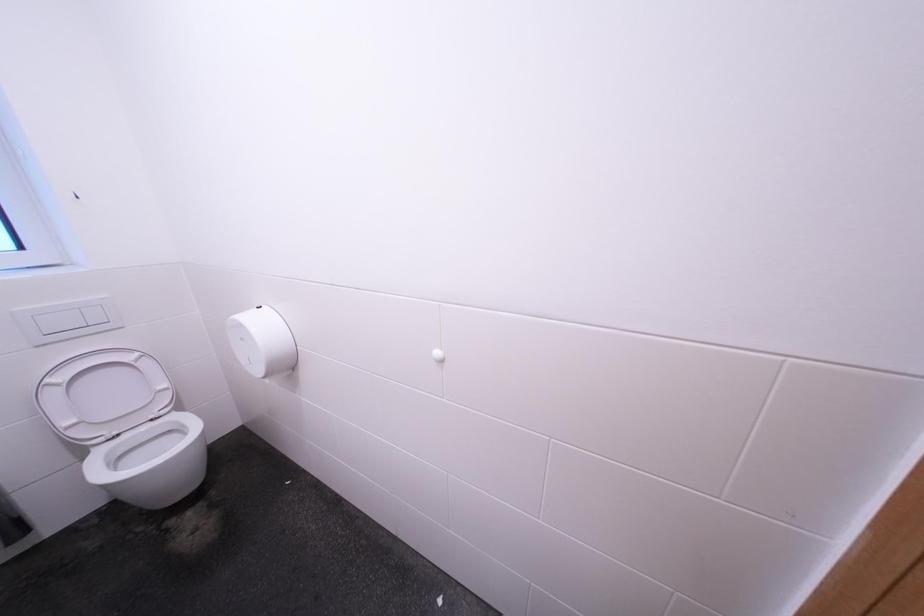
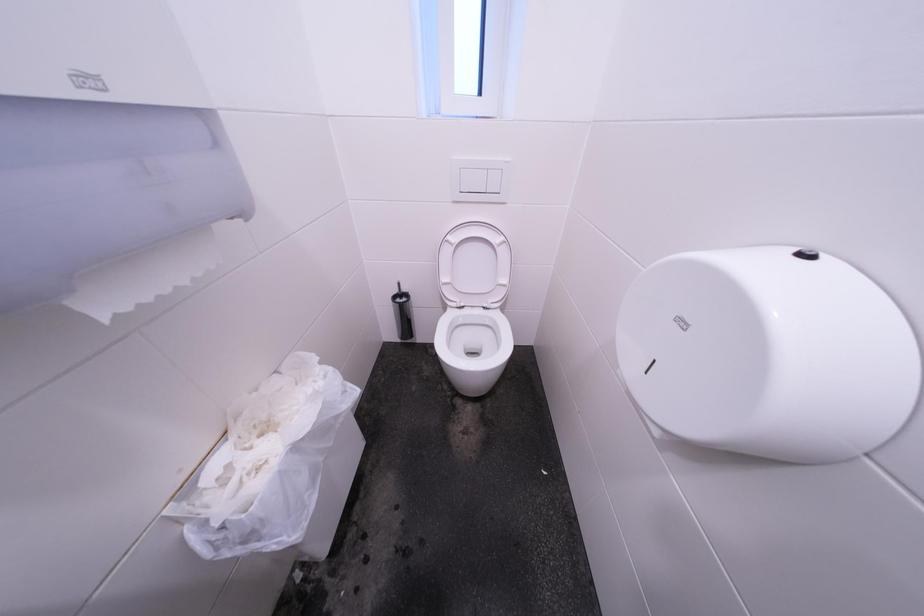
First-person continuous shooting, in which direction is the camera rotating?

The rotation direction of the camera is left-down.